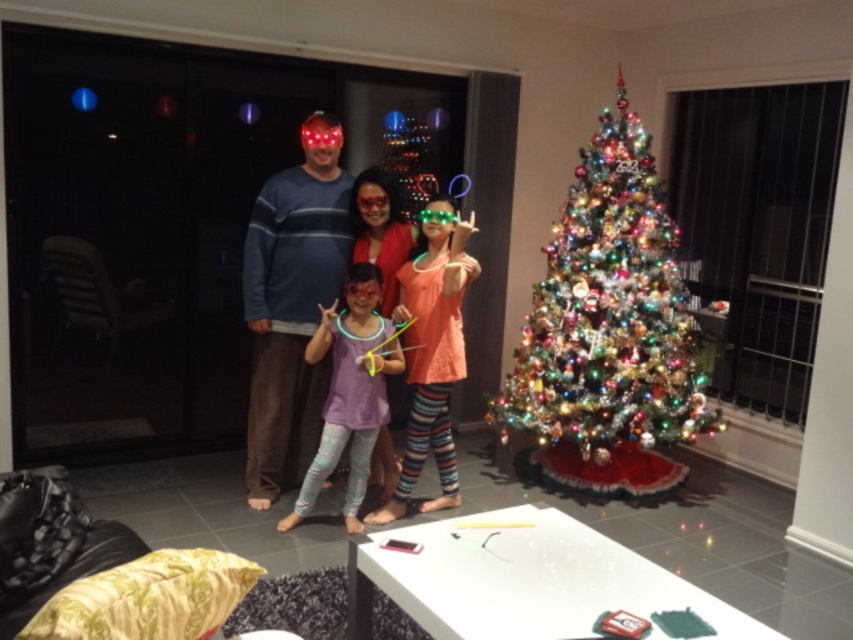
Question: Which of the following is the farthest from the observer?

Choices:
 (A) neon plastic glasses at center
 (B) purple matte leggings at center

Answer: (A)

Question: Does neon plastic glasses at center have a larger size compared to purple matte leggings at center?

Choices:
 (A) no
 (B) yes

Answer: (B)

Question: Which of the following is the closest to the observer?

Choices:
 (A) (280, 369)
 (B) (618, 88)

Answer: (A)

Question: From the image, what is the correct spatial relationship of shiny metallic christmas tree at right in relation to neon plastic glasses at center?

Choices:
 (A) below
 (B) above

Answer: (B)

Question: Which object is closer to the camera taking this photo?

Choices:
 (A) purple matte leggings at center
 (B) shiny metallic christmas tree at right

Answer: (A)

Question: Does shiny metallic christmas tree at right have a larger size compared to purple matte leggings at center?

Choices:
 (A) no
 (B) yes

Answer: (B)